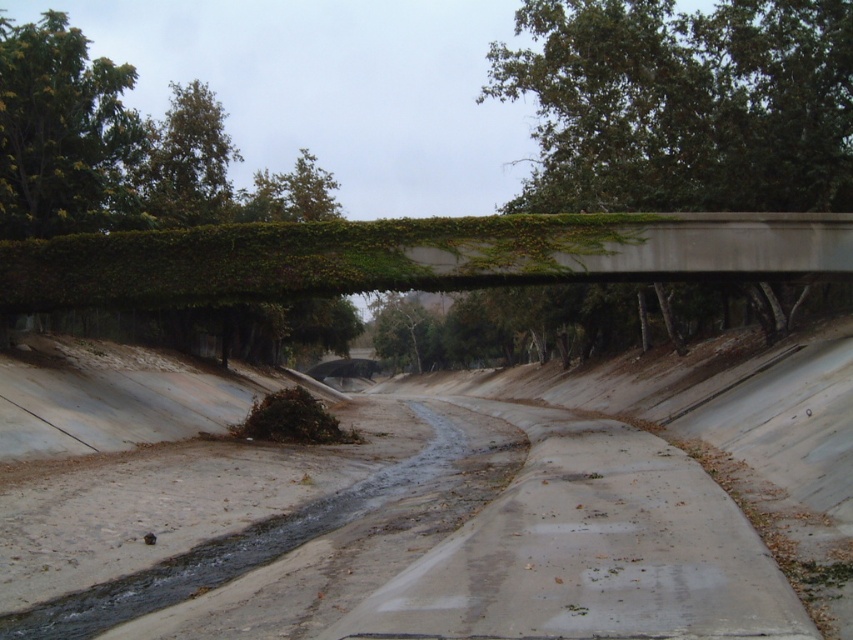
You are a delivery person trying to cross the dull concrete dirt track at center with a cart that is 3 meters wide. The green leafy tree at upper center is blocking your path. Can you pass through the track without hitting the tree?

The dull concrete dirt track at center has a lesser width compared to green leafy tree at upper center, so the track is narrower than the tree. Since your cart is 3 meters wide, you need to check if the track is wide enough. However, the description only states the track is narrower than the tree, but doesn not provide exact measurements. Therefore, it is uncertain if the cart can pass safely without hitting the tree.

In the scene shown: You are standing on the concrete bridge overlooking the storm drain. You notice two points marked in the image. Which point, point (816, 490) or point (767, 60), is closer to you?

Point (816, 490) is closer to you than point (767, 60).